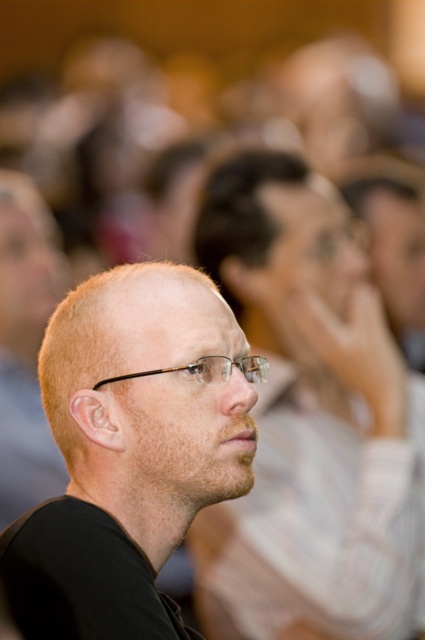
Consider the image. You are taking a photo of the scene described. You need to ensure that both the matte black shirt at center and the clear plastic glasses at center are clearly visible. Given their sizes, which object might require you to adjust your camera focus more carefully?

The clear plastic glasses at center might require more careful focus adjustment since they are smaller in size than the matte black shirt at center.

You are standing in the conference hall and need to locate the person wearing the matte black shirt at center. According to the coordinates provided, where exactly is this person positioned in the room?

The matte black shirt at center is located at coordinates point (130,451).

You are standing in the conference hall and see two points marked in the image. The first point is at coordinates point (229, 266) and the second point is at point (51, 349). Which point is closer to you?

Point (51, 349) is closer to you because it is in front of point (229, 266).